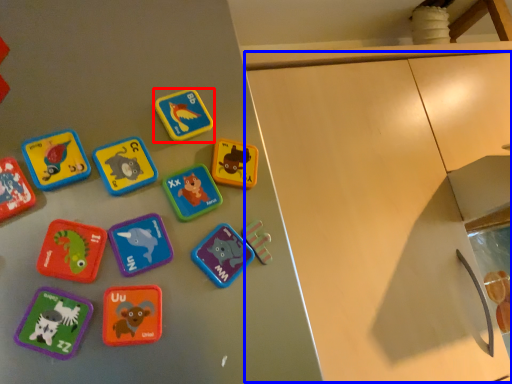
Question: Which object is closer to the camera taking this photo, toy (highlighted by a red box) or cabinetry (highlighted by a blue box)?

Choices:
 (A) toy
 (B) cabinetry

Answer: (A)